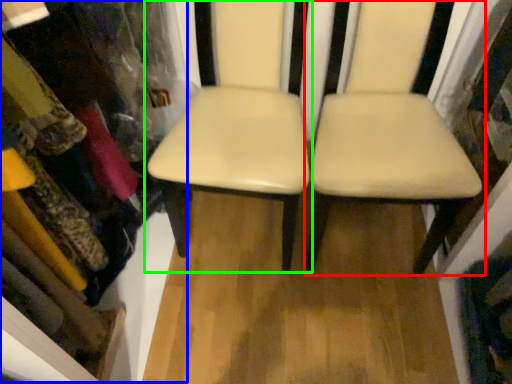
Question: Estimate the real-world distances between objects in this image. Which object is farther from chair (highlighted by a red box), bookshelf (highlighted by a blue box) or chair (highlighted by a green box)?

Choices:
 (A) bookshelf
 (B) chair

Answer: (A)